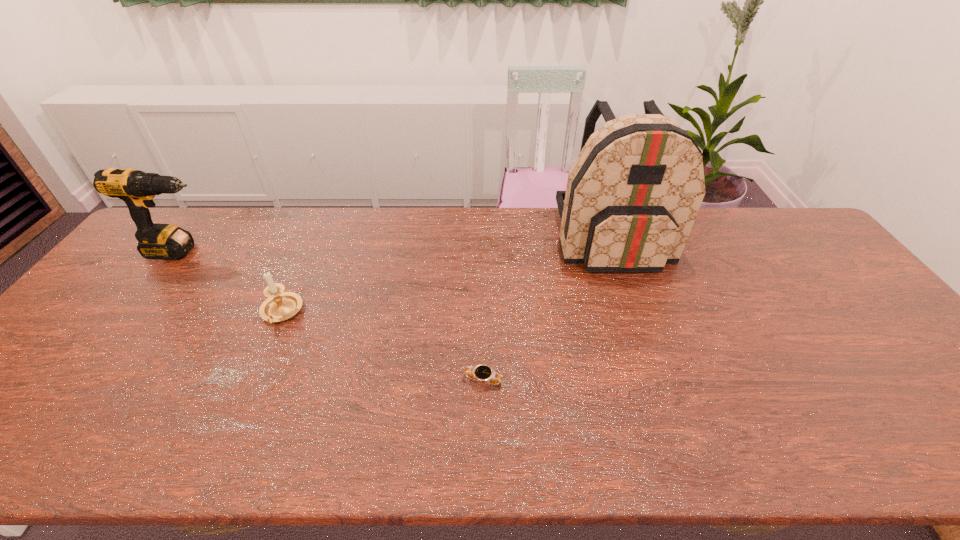
The width and height of the screenshot is (960, 540). I want to click on vacant space situated with a handle on the side of the second object from left to right, so click(248, 388).

At what (x,y) coordinates should I click in order to perform the action: click on free point located 0.320m on the left of the nearest object. Please return your answer as a coordinate pair (x, y). Looking at the image, I should click on [328, 380].

Where is `backpack positioned at the far edge`? backpack positioned at the far edge is located at coordinates tap(633, 193).

The height and width of the screenshot is (540, 960). I want to click on drill located in the far edge section of the desktop, so click(x=136, y=188).

Find the location of a particular element. object positioned at the left edge is located at coordinates (136, 188).

In order to click on object present at the far left corner in this screenshot , I will do `click(136, 188)`.

This screenshot has width=960, height=540. I want to click on vacant space at the far edge of the desktop, so click(x=541, y=218).

Locate an element on the screen. The image size is (960, 540). vacant space at the near edge of the desktop is located at coordinates pos(125,425).

This screenshot has width=960, height=540. In the image, there is a desktop. In order to click on vacant space at the right edge in this screenshot , I will do `click(803, 284)`.

Find the location of a particular element. The width and height of the screenshot is (960, 540). vacant area that lies between the watch and the backpack is located at coordinates (548, 310).